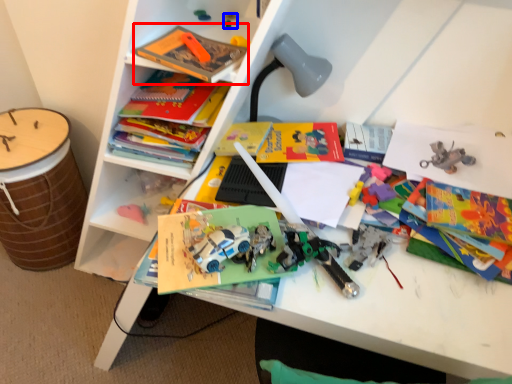
Question: Among these objects, which one is farthest to the camera, book (highlighted by a red box) or toy (highlighted by a blue box)?

Choices:
 (A) book
 (B) toy

Answer: (B)